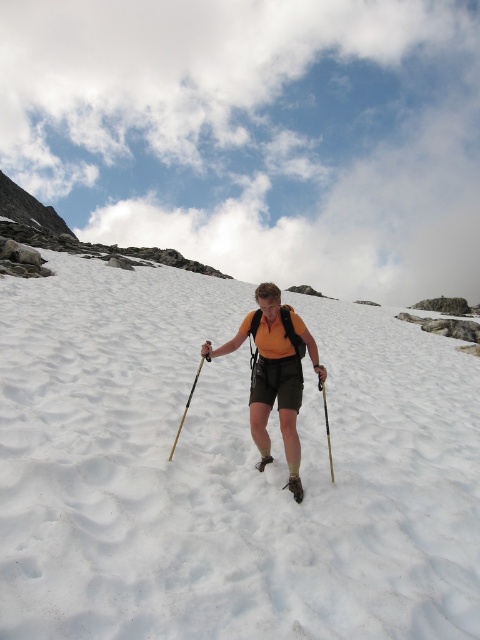
Is orange fabric shorts at center thinner than black plastic ski pole at center?

In fact, orange fabric shorts at center might be wider than black plastic ski pole at center.

Does orange fabric shorts at center have a smaller size compared to black plastic ski pole at center?

No.

Image resolution: width=480 pixels, height=640 pixels. Describe the element at coordinates (275, 372) in the screenshot. I see `orange fabric shorts at center` at that location.

Locate an element on the screen. This screenshot has height=640, width=480. orange fabric shorts at center is located at coordinates (275, 372).

Is point (465, 586) more distant than point (273, 346)?

No, (465, 586) is closer to viewer.

Is point (15, 497) farther from camera compared to point (261, 332)?

No, it is not.

This screenshot has width=480, height=640. I want to click on white powdery snow at center, so click(x=227, y=468).

Between white powdery snow at center and wooden ski pole at center, which one is positioned lower?

Positioned lower is wooden ski pole at center.

Is white powdery snow at center above wooden ski pole at center?

Yes.

Is point (160, 621) positioned behind point (196, 372)?

No, (160, 621) is closer to viewer.

Locate an element on the screen. This screenshot has width=480, height=640. white powdery snow at center is located at coordinates (227, 468).